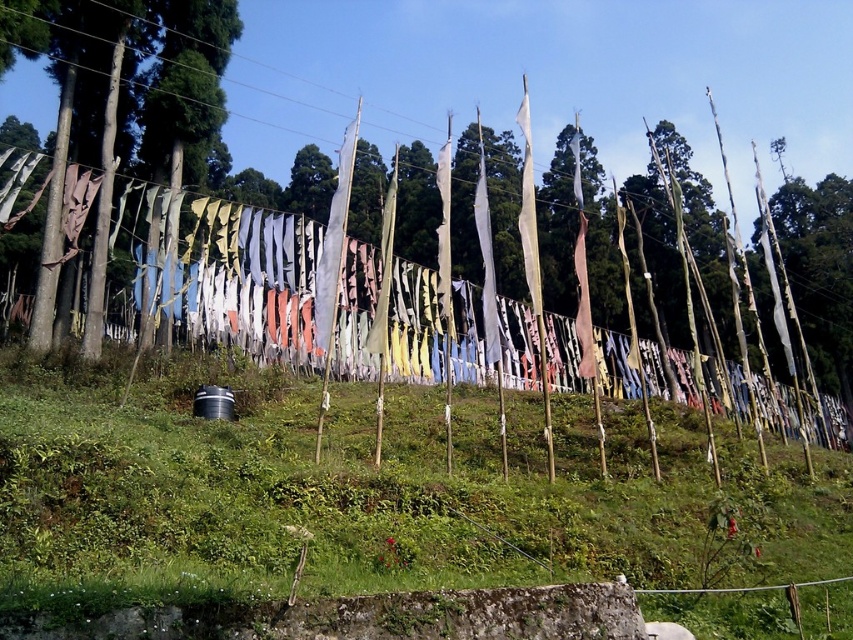
You are standing in the middle of the prayer flags area and want to take a photo of the green grassy at center and the green leafy tree at center. Which one will appear larger in your photo?

The green grassy at center will appear larger in your photo because it is closer to you than the green leafy tree at center.

You are standing in the outdoor scene and want to take a photo of the green grassy at center and the green matte tree at left. Which one should you focus on first if you want both to be in sharp focus?

The green grassy at center is closer to the viewer than the green matte tree at left. To have both in sharp focus, focus on the green matte tree at left since it is farther away, ensuring the depth of field includes both.

Looking at this image, you are standing at the bottom of the slope and looking up at the two trees in the scene. Which tree is closer to you, the green leafy tree at center or the green matte tree at left?

The green leafy tree at center is closer to you because the green matte tree at left is behind it.